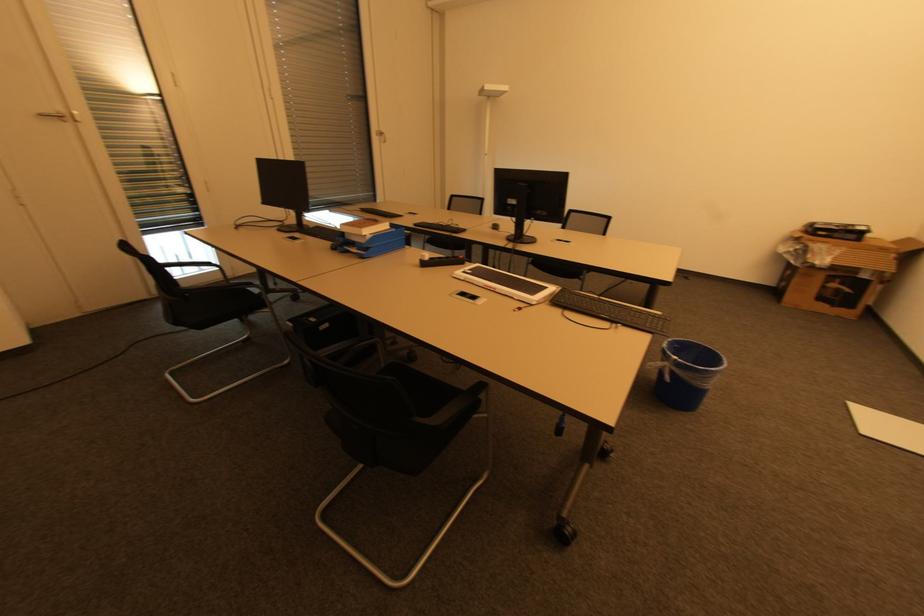
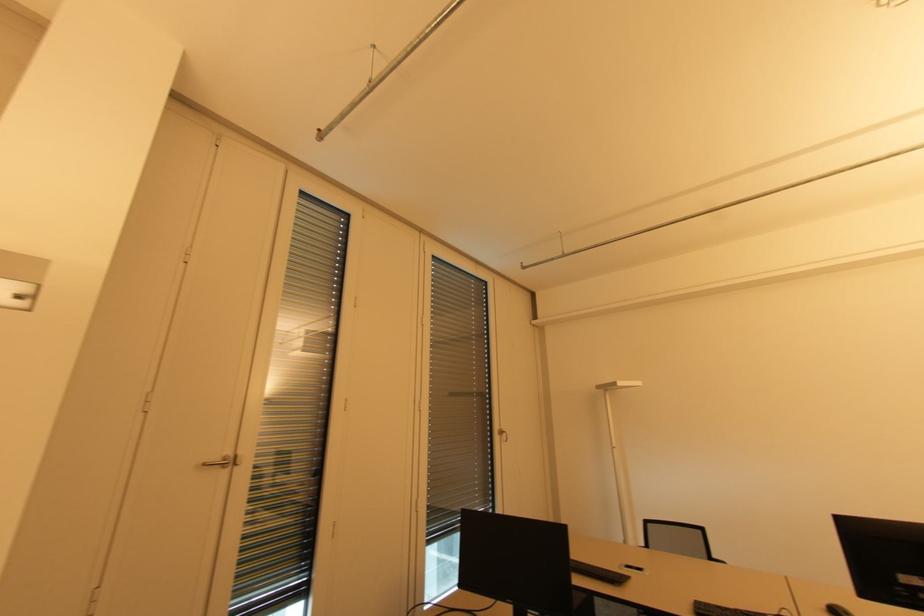
The point at (380, 136) is marked in the first image. Where is the corresponding point in the second image?

(501, 435)